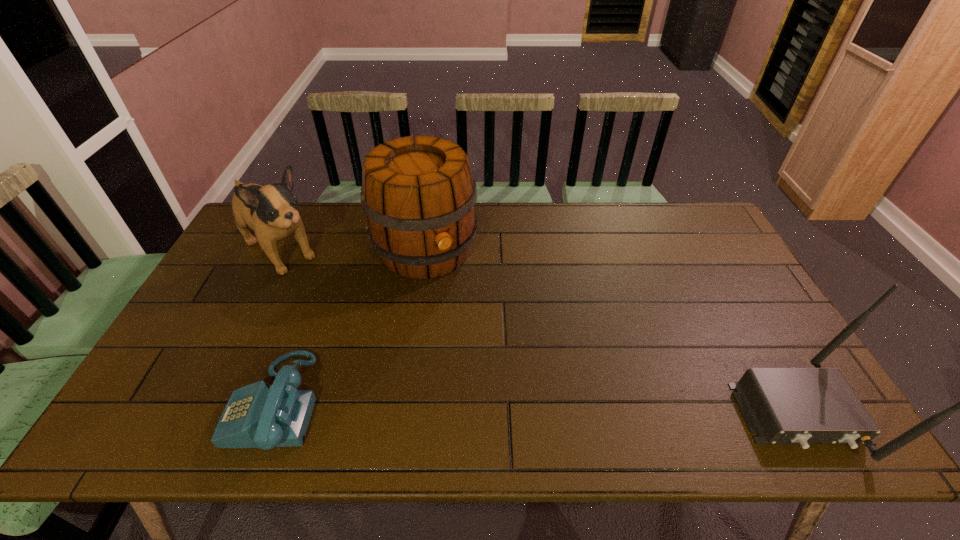
Where is `telephone`? Image resolution: width=960 pixels, height=540 pixels. telephone is located at coordinates (x=257, y=415).

In order to click on router in this screenshot , I will do [803, 406].

Where is `cider`? Image resolution: width=960 pixels, height=540 pixels. cider is located at coordinates pos(419,198).

This screenshot has width=960, height=540. What are the coordinates of `puppy` in the screenshot? It's located at (271, 211).

The height and width of the screenshot is (540, 960). Find the location of `vacant area situated 0.060m on the dial of the shortest object`. vacant area situated 0.060m on the dial of the shortest object is located at coordinates (209, 403).

Locate an element on the screen. The image size is (960, 540). free space located 0.100m on the dial of the shortest object is located at coordinates (193, 403).

The image size is (960, 540). What are the coordinates of `vacant region located on the dial of the shortest object` in the screenshot? It's located at (180, 403).

The width and height of the screenshot is (960, 540). What are the coordinates of `vacant space situated on the side of the second object from right to left where the spigot is located` in the screenshot? It's located at pos(493,362).

At what (x,y) coordinates should I click in order to perform the action: click on vacant space positioned 0.200m on the side of the second object from right to left where the spigot is located. Please return your answer as a coordinate pair (x, y). This screenshot has width=960, height=540. Looking at the image, I should click on (475, 332).

Identify the location of vacant point located 0.070m on the side of the second object from right to left where the spigot is located. (455, 300).